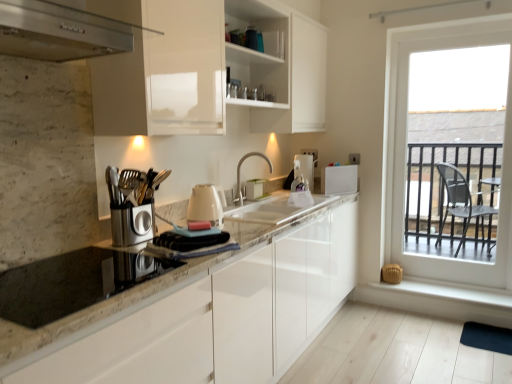
The width and height of the screenshot is (512, 384). Identify the location of blank space above black glass cooktop at lower left, placed as the 4th appliance when sorted from right to left (from a real-world perspective). (57, 284).